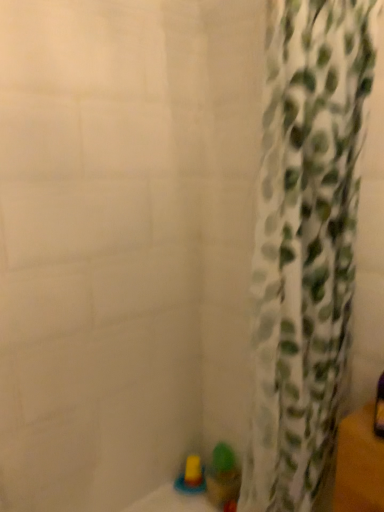
Question: Which direction should I rotate to face translucent plastic cup at lower center, arranged as the first toy when viewed from the right, — up or down?

Choices:
 (A) down
 (B) up

Answer: (A)

Question: Should I look upward or downward to see white fabric curtain at right?

Choices:
 (A) up
 (B) down

Answer: (B)

Question: Can you confirm if translucent plastic cup at lower center, the second toy viewed from the left, is thinner than white fabric curtain at right?

Choices:
 (A) yes
 (B) no

Answer: (A)

Question: Does translucent plastic cup at lower center, arranged as the first toy when viewed from the right, have a larger size compared to white fabric curtain at right?

Choices:
 (A) yes
 (B) no

Answer: (B)

Question: Does translucent plastic cup at lower center, the second toy viewed from the left, turn towards white fabric curtain at right?

Choices:
 (A) no
 (B) yes

Answer: (A)

Question: Is the position of translucent plastic cup at lower center, the second toy viewed from the left, more distant than that of white fabric curtain at right?

Choices:
 (A) yes
 (B) no

Answer: (A)

Question: Is translucent plastic cup at lower center, the second toy viewed from the left, beside white fabric curtain at right?

Choices:
 (A) yes
 (B) no

Answer: (B)

Question: From the image's perspective, is translucent plastic cup at lower center, the second toy viewed from the left, beneath white fabric curtain at right?

Choices:
 (A) no
 (B) yes

Answer: (B)

Question: Is translucent yellow toy at lower center, which is counted as the 1th toy, starting from the left, positioned beyond the bounds of translucent plastic cup at lower center, the second toy viewed from the left?

Choices:
 (A) no
 (B) yes

Answer: (B)

Question: From a real-world perspective, is translucent yellow toy at lower center, the 2th toy from the right, on top of translucent plastic cup at lower center, arranged as the first toy when viewed from the right?

Choices:
 (A) no
 (B) yes

Answer: (A)

Question: From a real-world perspective, is translucent yellow toy at lower center, which is counted as the 1th toy, starting from the left, below translucent plastic cup at lower center, the second toy viewed from the left?

Choices:
 (A) yes
 (B) no

Answer: (A)

Question: Could you tell me if translucent yellow toy at lower center, which is counted as the 1th toy, starting from the left, is turned towards translucent plastic cup at lower center, the second toy viewed from the left?

Choices:
 (A) yes
 (B) no

Answer: (B)

Question: Is translucent yellow toy at lower center, which is counted as the 1th toy, starting from the left, looking in the opposite direction of translucent plastic cup at lower center, the second toy viewed from the left?

Choices:
 (A) yes
 (B) no

Answer: (B)

Question: Does translucent yellow toy at lower center, which is counted as the 1th toy, starting from the left, lie in front of translucent plastic cup at lower center, arranged as the first toy when viewed from the right?

Choices:
 (A) yes
 (B) no

Answer: (B)

Question: Is translucent yellow toy at lower center, the 2th toy from the right, inside translucent plastic cup at lower center, the second toy viewed from the left?

Choices:
 (A) no
 (B) yes

Answer: (A)